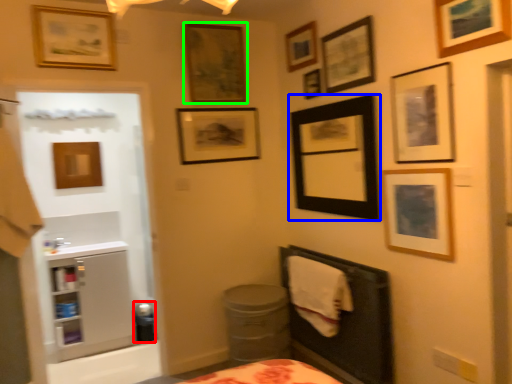
Question: Which is nearer to the potty (highlighted by a red box)? picture frame (highlighted by a blue box) or picture frame (highlighted by a green box).

Choices:
 (A) picture frame
 (B) picture frame

Answer: (A)